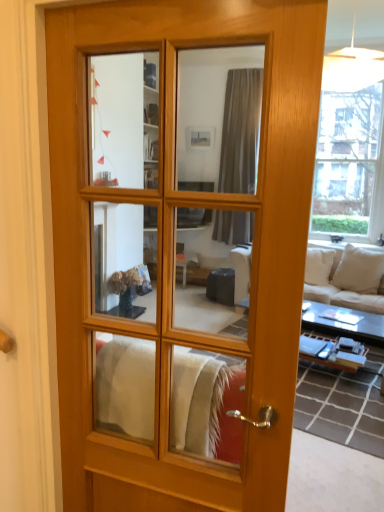
Question: In terms of height, does white fabric couch at right look taller or shorter compared to matte wood door at center?

Choices:
 (A) short
 (B) tall

Answer: (A)

Question: From the image's perspective, is white fabric couch at right located above or below matte wood door at center?

Choices:
 (A) above
 (B) below

Answer: (B)

Question: From a real-world perspective, is white fabric couch at right above or below matte wood door at center?

Choices:
 (A) below
 (B) above

Answer: (A)

Question: Considering their positions, is matte wood door at center located in front of or behind white fabric couch at right?

Choices:
 (A) behind
 (B) front

Answer: (B)

Question: Considering the relative positions of matte wood door at center and white fabric couch at right in the image provided, is matte wood door at center to the left or to the right of white fabric couch at right?

Choices:
 (A) left
 (B) right

Answer: (A)

Question: From a real-world perspective, is matte wood door at center positioned above or below white fabric couch at right?

Choices:
 (A) below
 (B) above

Answer: (B)

Question: Is matte wood door at center bigger or smaller than white fabric couch at right?

Choices:
 (A) big
 (B) small

Answer: (B)